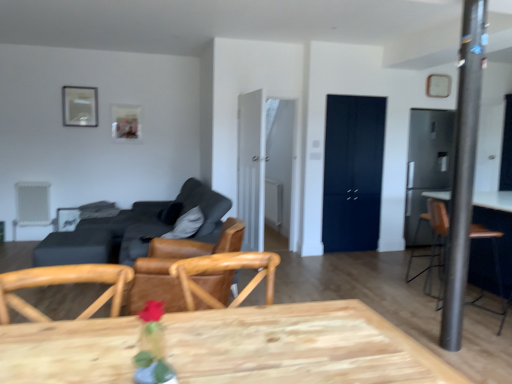
Question: Which direction should I rotate to look at metallic silver picture frame at upper center, arranged as the second picture frame when viewed from the left?

Choices:
 (A) left
 (B) right

Answer: (A)

Question: Is dark gray fabric couch at center-left positioned far away from brown leather armchair at right, which appears as the 1th armchair when viewed from the right?

Choices:
 (A) no
 (B) yes

Answer: (B)

Question: Is the depth of dark gray fabric couch at center-left less than that of brown leather armchair at right, which is counted as the 2th armchair, starting from the left?

Choices:
 (A) yes
 (B) no

Answer: (B)

Question: Is dark gray fabric couch at center-left further to the viewer compared to brown leather armchair at right, which appears as the 1th armchair when viewed from the right?

Choices:
 (A) no
 (B) yes

Answer: (B)

Question: Can you confirm if dark gray fabric couch at center-left is bigger than brown leather armchair at right, which appears as the 1th armchair when viewed from the front?

Choices:
 (A) no
 (B) yes

Answer: (B)

Question: Is dark gray fabric couch at center-left surrounding brown leather armchair at right, which appears as the 2th armchair when viewed from the back?

Choices:
 (A) no
 (B) yes

Answer: (A)

Question: Can you confirm if dark gray fabric couch at center-left is thinner than brown leather armchair at right, which appears as the 1th armchair when viewed from the front?

Choices:
 (A) yes
 (B) no

Answer: (B)

Question: Is the depth of satin black refrigerator at right greater than that of brown leather chair at center?

Choices:
 (A) yes
 (B) no

Answer: (A)

Question: Does satin black refrigerator at right have a lesser width compared to brown leather chair at center?

Choices:
 (A) yes
 (B) no

Answer: (A)

Question: Is satin black refrigerator at right facing away from brown leather chair at center?

Choices:
 (A) no
 (B) yes

Answer: (A)

Question: Does satin black refrigerator at right have a greater width compared to brown leather chair at center?

Choices:
 (A) no
 (B) yes

Answer: (A)

Question: Is satin black refrigerator at right smaller than brown leather chair at center?

Choices:
 (A) yes
 (B) no

Answer: (A)

Question: Would you say satin black refrigerator at right is outside brown leather chair at center?

Choices:
 (A) yes
 (B) no

Answer: (A)

Question: From a real-world perspective, is metallic silver picture frame at upper center, positioned as the third picture frame in front-to-back order, below metallic pole at right?

Choices:
 (A) yes
 (B) no

Answer: (B)